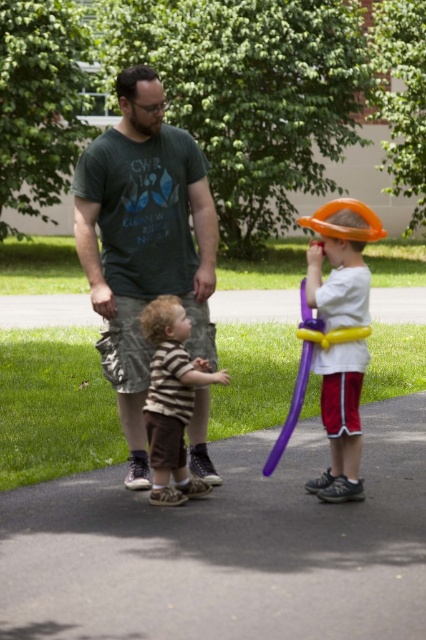
Question: Which object is closer to the camera taking this photo?

Choices:
 (A) striped cotton shirt at center
 (B) orange matte balloon at right
 (C) smooth asphalt pavement at center
 (D) dark green t-shirt at center

Answer: (C)

Question: Does smooth asphalt pavement at center appear on the left side of striped cotton shirt at center?

Choices:
 (A) yes
 (B) no

Answer: (B)

Question: Based on their relative distances, which object is nearer to the dark green t-shirt at center?

Choices:
 (A) striped cotton shirt at center
 (B) smooth concrete path at center

Answer: (A)

Question: Can you confirm if smooth concrete path at center is wider than orange matte balloon at right?

Choices:
 (A) yes
 (B) no

Answer: (A)

Question: Can you confirm if dark green t-shirt at center is positioned to the right of smooth concrete path at center?

Choices:
 (A) no
 (B) yes

Answer: (A)

Question: Estimate the real-world distances between objects in this image. Which object is farther from the dark green t-shirt at center?

Choices:
 (A) smooth concrete path at center
 (B) smooth asphalt pavement at center
 (C) orange matte balloon at right
 (D) striped cotton shirt at center

Answer: (A)